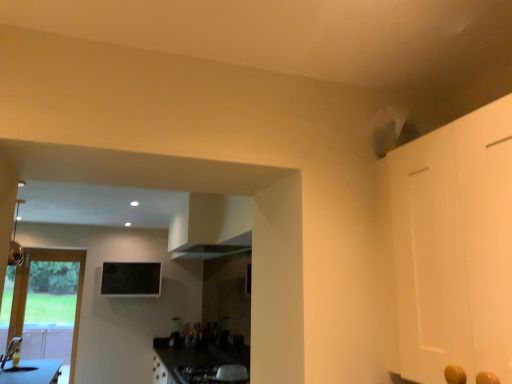
Question: Would you say wooden door at left is part of black glass window screen at upper center's contents?

Choices:
 (A) yes
 (B) no

Answer: (B)

Question: Is black glass window screen at upper center far from wooden door at left?

Choices:
 (A) no
 (B) yes

Answer: (A)

Question: Is black glass window screen at upper center facing away from wooden door at left?

Choices:
 (A) yes
 (B) no

Answer: (B)

Question: From the image's perspective, is black glass window screen at upper center below wooden door at left?

Choices:
 (A) yes
 (B) no

Answer: (B)

Question: Does black glass window screen at upper center have a greater height compared to wooden door at left?

Choices:
 (A) no
 (B) yes

Answer: (A)

Question: Is black glass window screen at upper center taller or shorter than wooden door at left?

Choices:
 (A) tall
 (B) short

Answer: (B)

Question: Do you think black glass window screen at upper center is within wooden door at left, or outside of it?

Choices:
 (A) inside
 (B) outside

Answer: (B)

Question: From the image's perspective, is black glass window screen at upper center above or below wooden door at left?

Choices:
 (A) below
 (B) above

Answer: (B)

Question: From a real-world perspective, is black glass window screen at upper center positioned above or below wooden door at left?

Choices:
 (A) below
 (B) above

Answer: (B)

Question: From the image's perspective, is wooden door at left located above or below black glass window screen at upper center?

Choices:
 (A) above
 (B) below

Answer: (B)

Question: Considering the relative positions of wooden door at left and black glass window screen at upper center in the image provided, is wooden door at left to the left or to the right of black glass window screen at upper center?

Choices:
 (A) left
 (B) right

Answer: (A)

Question: Considering their positions, is wooden door at left located in front of or behind black glass window screen at upper center?

Choices:
 (A) behind
 (B) front

Answer: (B)

Question: From a real-world perspective, is wooden door at left physically located above or below black glass window screen at upper center?

Choices:
 (A) above
 (B) below

Answer: (B)

Question: From a real-world perspective, is metallic silver gas stove at lower center physically located above or below wooden door at left?

Choices:
 (A) above
 (B) below

Answer: (B)

Question: From the image's perspective, relative to wooden door at left, is metallic silver gas stove at lower center above or below?

Choices:
 (A) below
 (B) above

Answer: (B)